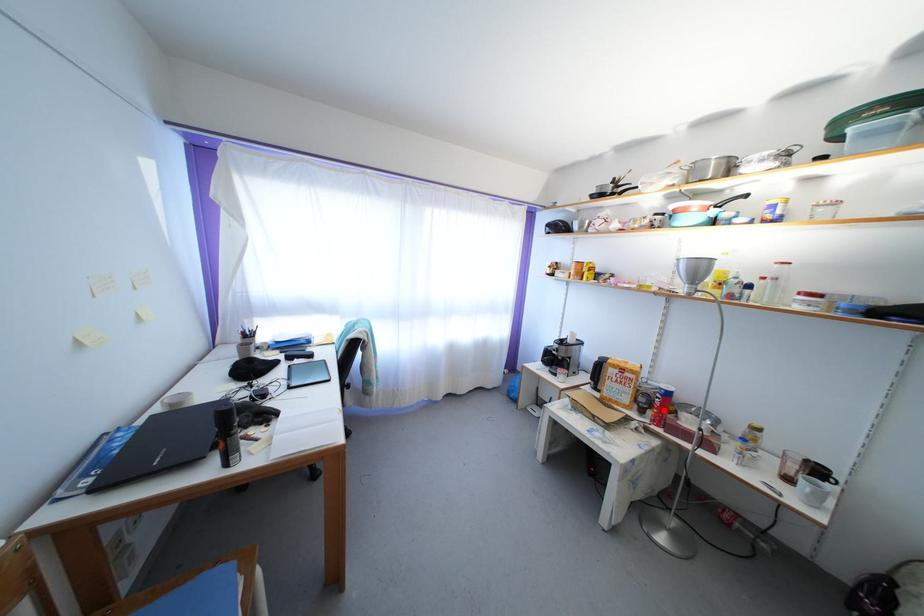
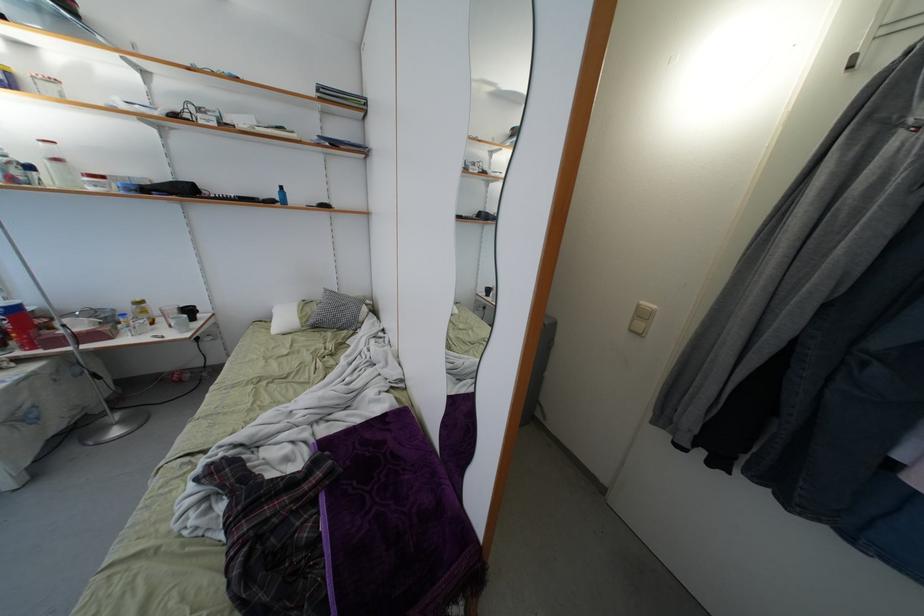
Question: I am providing you with two images of the same scene from different viewpoints. A red point is shown in image1. For the corresponding object point in image2, is it positioned nearer or farther from the camera?

Choices:
 (A) Nearer
 (B) Farther

Answer: (B)